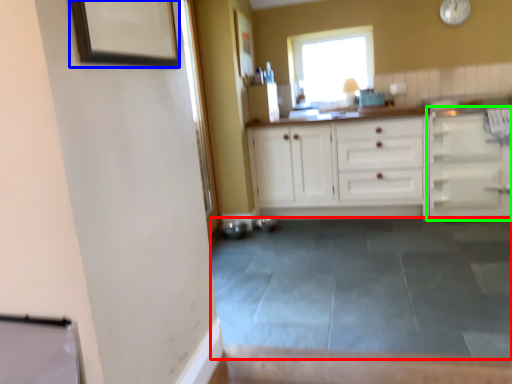
Question: Considering the real-world distances, which object is farthest from concrete (highlighted by a red box)? picture frame (highlighted by a blue box) or cabinetry (highlighted by a green box)?

Choices:
 (A) picture frame
 (B) cabinetry

Answer: (A)